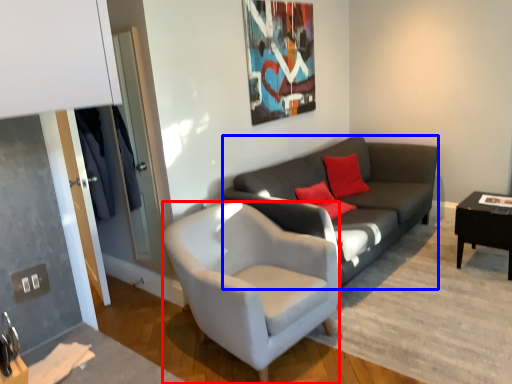
Question: Which object is closer to the camera taking this photo, chair (highlighted by a red box) or studio couch (highlighted by a blue box)?

Choices:
 (A) chair
 (B) studio couch

Answer: (A)